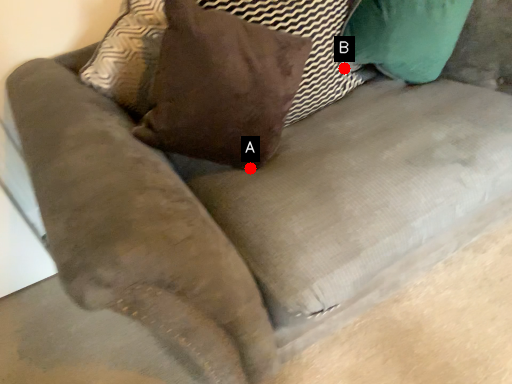
Question: Two points are circled on the image, labeled by A and B beside each circle. Which of the following is the closest to the observer?

Choices:
 (A) A is closer
 (B) B is closer

Answer: (A)